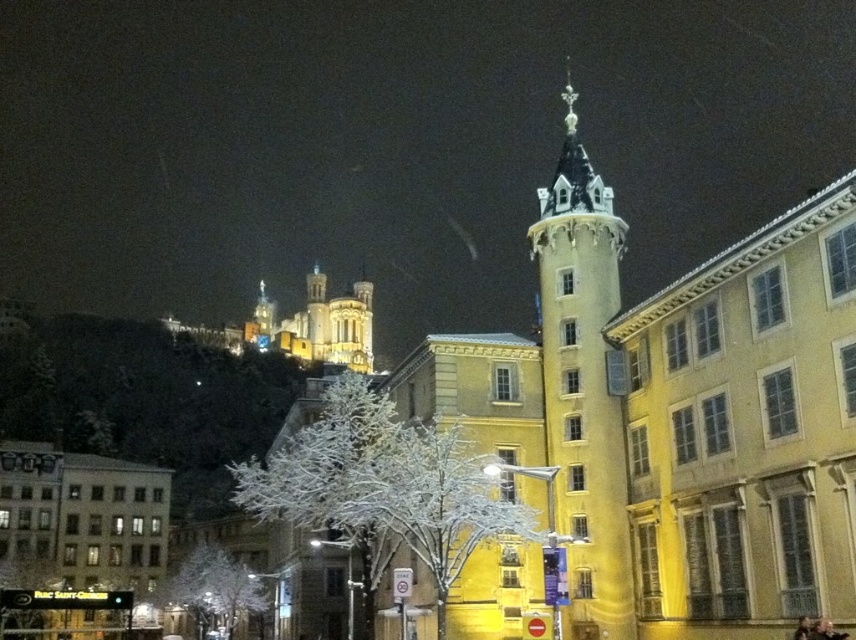
Question: Is matte yellow tower at center to the left of snow-covered tree at center from the viewer's perspective?

Choices:
 (A) yes
 (B) no

Answer: (B)

Question: Is snow-covered tree at center positioned at the back of white snow-covered tree at lower center?

Choices:
 (A) yes
 (B) no

Answer: (B)

Question: Which point is farther from the camera taking this photo?

Choices:
 (A) (278, 499)
 (B) (556, 636)

Answer: (A)

Question: Which point appears farthest from the camera in this image?

Choices:
 (A) (201, 618)
 (B) (308, 456)
 (C) (563, 396)

Answer: (A)

Question: Which of these objects is positioned farthest from the snow-covered tree at center?

Choices:
 (A) white snow-covered tree at lower center
 (B) matte yellow tower at center

Answer: (B)

Question: Is matte yellow tower at center bigger than white snow-covered tree at lower center?

Choices:
 (A) yes
 (B) no

Answer: (A)